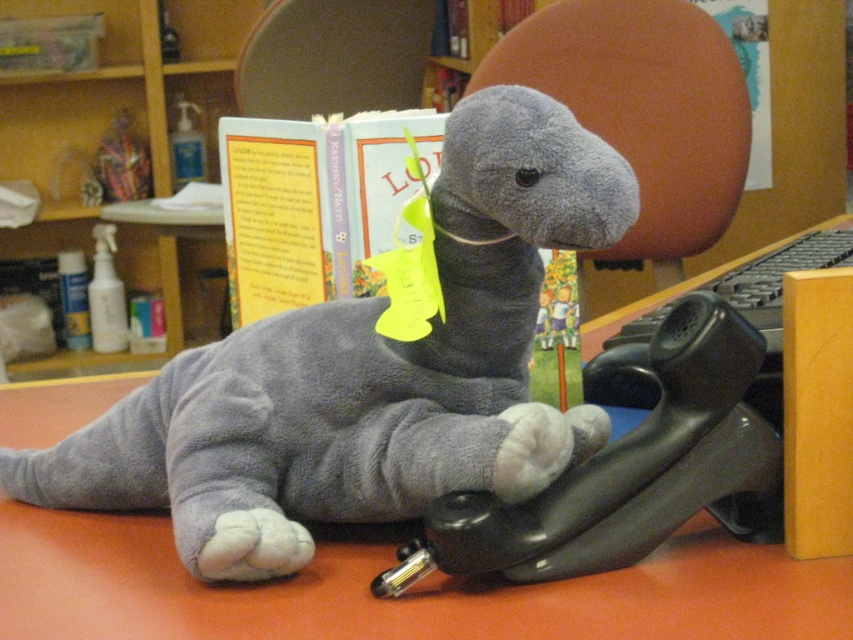
Question: Can you confirm if gray plush dinosaur at center is positioned to the left of black rubber telephone at lower center?

Choices:
 (A) yes
 (B) no

Answer: (A)

Question: Which is farther from the wooden bookshelf at upper center?

Choices:
 (A) gray plush dinosaur at center
 (B) black rubber telephone at lower center
 (C) light blue paper book at center

Answer: (B)

Question: Can you confirm if gray plush dinosaur at center is bigger than wooden bookshelf at upper center?

Choices:
 (A) yes
 (B) no

Answer: (B)

Question: Can you confirm if gray plush dinosaur at center is smaller than soft orange table at center?

Choices:
 (A) yes
 (B) no

Answer: (A)

Question: Which object is closer to the camera taking this photo?

Choices:
 (A) gray plush dinosaur at center
 (B) black rubber telephone at lower center
 (C) soft orange table at center

Answer: (C)

Question: Which of the following is the farthest from the observer?

Choices:
 (A) wooden bookshelf at upper center
 (B) black rubber telephone at lower center

Answer: (A)